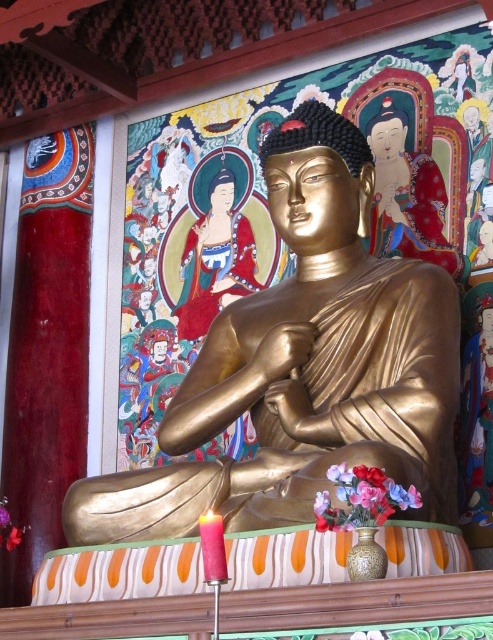
Question: Among these points, which one is farthest from the camera?

Choices:
 (A) (283, 385)
 (B) (185, 324)

Answer: (B)

Question: Which of the following is the closest to the observer?

Choices:
 (A) (195, 272)
 (B) (253, 413)

Answer: (B)

Question: Which point is farther to the camera?

Choices:
 (A) (226, 292)
 (B) (294, 138)

Answer: (A)

Question: Can you confirm if gold polished statue at center is positioned to the right of smooth gold statue at center?

Choices:
 (A) no
 (B) yes

Answer: (B)

Question: Is gold polished statue at center positioned at the back of smooth gold statue at center?

Choices:
 (A) no
 (B) yes

Answer: (A)

Question: Does gold polished statue at center appear on the left side of smooth gold statue at center?

Choices:
 (A) no
 (B) yes

Answer: (A)